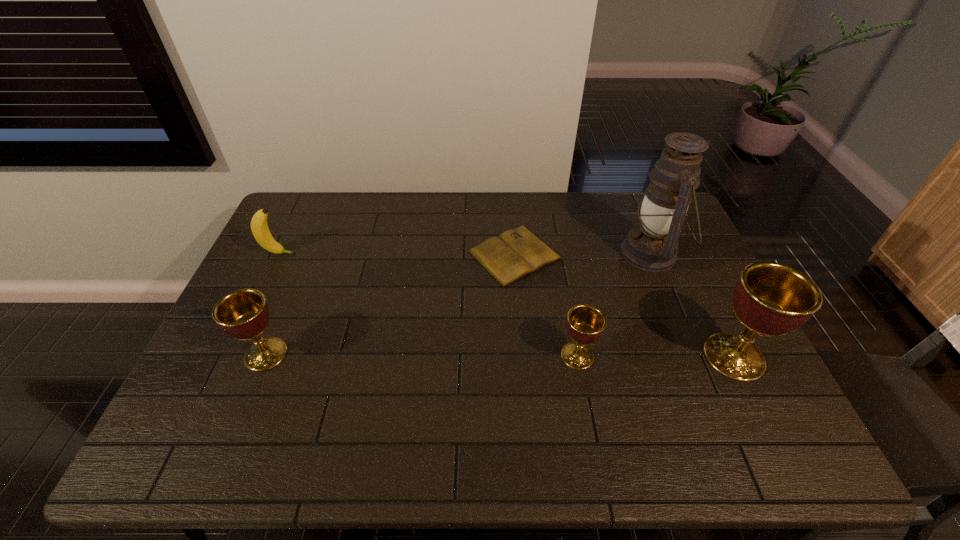
At what (x,y) coordinates should I click in order to perform the action: click on vacant point that satisfies the following two spatial constraints: 1. from the stem of the banana; 2. on the back side of the tallest chalice. Please return your answer as a coordinate pair (x, y). Looking at the image, I should click on (x=229, y=357).